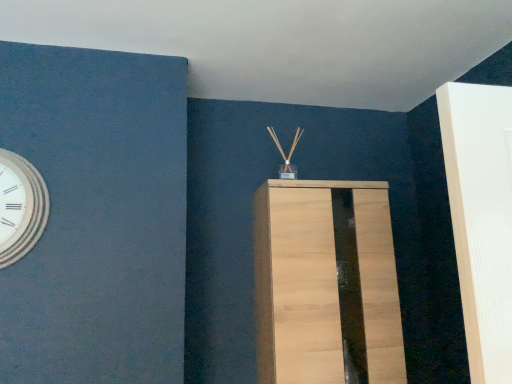
Question: Should I look upward or downward to see light wood cabinet at center?

Choices:
 (A) down
 (B) up

Answer: (A)

Question: Does white wooden wall clock at left have a larger size compared to light wood cabinet at center?

Choices:
 (A) yes
 (B) no

Answer: (B)

Question: From the image's perspective, is white wooden wall clock at left over light wood cabinet at center?

Choices:
 (A) yes
 (B) no

Answer: (A)

Question: Is white wooden wall clock at left not near light wood cabinet at center?

Choices:
 (A) no
 (B) yes

Answer: (A)

Question: Is white wooden wall clock at left positioned with its back to light wood cabinet at center?

Choices:
 (A) yes
 (B) no

Answer: (B)

Question: Does white wooden wall clock at left have a lesser height compared to light wood cabinet at center?

Choices:
 (A) yes
 (B) no

Answer: (A)

Question: Is white wooden wall clock at left in front of light wood cabinet at center?

Choices:
 (A) no
 (B) yes

Answer: (B)

Question: Is light wood cabinet at center aimed at white wooden wall clock at left?

Choices:
 (A) yes
 (B) no

Answer: (B)

Question: Does light wood cabinet at center have a lesser width compared to white wooden wall clock at left?

Choices:
 (A) yes
 (B) no

Answer: (B)

Question: Can you confirm if light wood cabinet at center is shorter than white wooden wall clock at left?

Choices:
 (A) yes
 (B) no

Answer: (B)

Question: Can you confirm if light wood cabinet at center is taller than white wooden wall clock at left?

Choices:
 (A) no
 (B) yes

Answer: (B)

Question: Would you say light wood cabinet at center is outside white wooden wall clock at left?

Choices:
 (A) yes
 (B) no

Answer: (A)

Question: Is the depth of light wood cabinet at center greater than that of white wooden wall clock at left?

Choices:
 (A) yes
 (B) no

Answer: (A)

Question: From their relative heights in the image, would you say light wood cabinet at center is taller or shorter than white wooden wall clock at left?

Choices:
 (A) short
 (B) tall

Answer: (B)